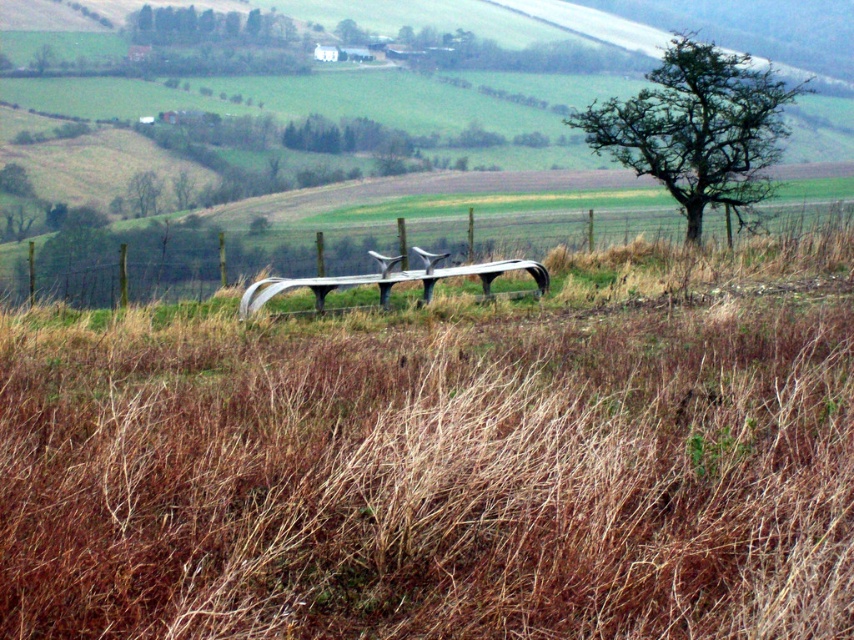
Is green leafy tree at upper right wider than green leafy tree at center?

Correct, the width of green leafy tree at upper right exceeds that of green leafy tree at center.

Does green leafy tree at upper right have a larger size compared to green leafy tree at center?

Indeed, green leafy tree at upper right has a larger size compared to green leafy tree at center.

Which is in front, point (771, 84) or point (156, 186)?

Point (771, 84) is more forward.

The height and width of the screenshot is (640, 854). I want to click on green leafy tree at upper right, so click(x=697, y=129).

You are a GUI agent. You are given a task and a screenshot of the screen. Output one action in this format:
    pyautogui.click(x=<x>, y=<y>)
    Task: Click on the metal wire fence at center
    The height and width of the screenshot is (640, 854).
    Given the screenshot: What is the action you would take?
    pyautogui.click(x=706, y=259)

Based on the photo, can you confirm if metal wire fence at center is positioned below green leafy tree at center?

Yes, metal wire fence at center is below green leafy tree at center.

Does point (539, 244) come closer to viewer compared to point (133, 186)?

Yes, it is in front of point (133, 186).

Locate an element on the screen. metal wire fence at center is located at coordinates (706, 259).

Is metal wire fence at center further to camera compared to green leafy tree at upper right?

No, it is in front of green leafy tree at upper right.

Between metal wire fence at center and green leafy tree at upper right, which one appears on the right side from the viewer's perspective?

From the viewer's perspective, green leafy tree at upper right appears more on the right side.

Who is more forward, (38,310) or (689,60)?

Positioned in front is point (38,310).

You are a GUI agent. You are given a task and a screenshot of the screen. Output one action in this format:
    pyautogui.click(x=<x>, y=<y>)
    Task: Click on the metal wire fence at center
    Image resolution: width=854 pixels, height=640 pixels.
    Given the screenshot: What is the action you would take?
    pyautogui.click(x=706, y=259)